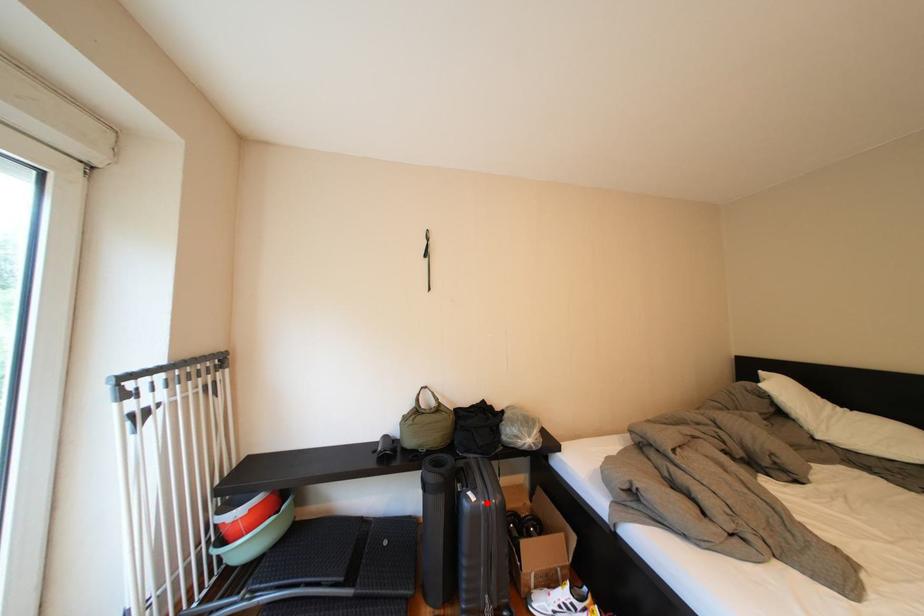
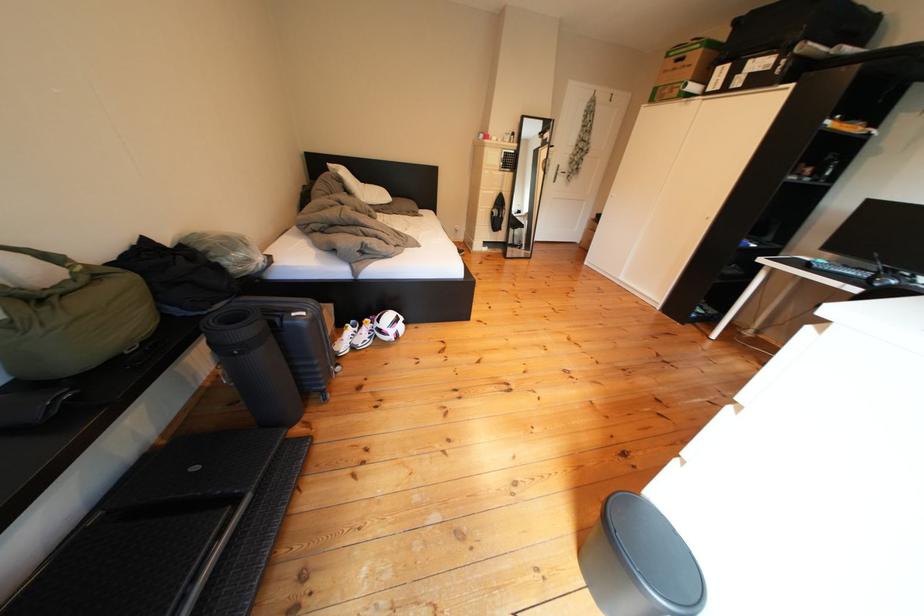
Question: I am providing you with two images of the same scene from different viewpoints. In image1, a red point is highlighted. Considering the same 3D point in image2, which of the following is correct?

Choices:
 (A) It is closer
 (B) It is farther

Answer: (A)